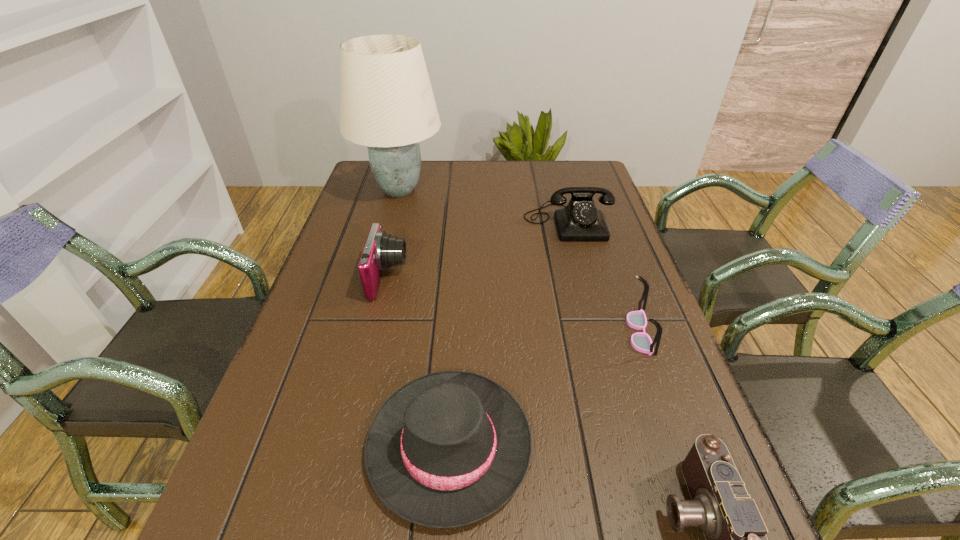
At what (x,y) coordinates should I click in order to perform the action: click on vacant region located on the right of the dress hat. Please return your answer as a coordinate pair (x, y). Looking at the image, I should click on (684, 445).

Locate an element on the screen. object that is at the far edge is located at coordinates (386, 100).

The width and height of the screenshot is (960, 540). What are the coordinates of `lampshade located in the left edge section of the desktop` in the screenshot? It's located at (386, 100).

You are a GUI agent. You are given a task and a screenshot of the screen. Output one action in this format:
    pyautogui.click(x=<x>, y=<y>)
    Task: Click on the camera positioned at the left edge
    
    Given the screenshot: What is the action you would take?
    pyautogui.click(x=381, y=250)

At what (x,y) coordinates should I click in order to perform the action: click on telephone at the right edge. Please return your answer as a coordinate pair (x, y). The width and height of the screenshot is (960, 540). Looking at the image, I should click on (580, 220).

Locate an element on the screen. This screenshot has height=540, width=960. spectacles that is at the right edge is located at coordinates (641, 341).

In order to click on object present at the far left corner in this screenshot , I will do `click(386, 100)`.

Locate an element on the screen. This screenshot has height=540, width=960. free space at the far edge is located at coordinates (431, 166).

In order to click on free space at the left edge of the desktop in this screenshot , I will do `click(389, 201)`.

This screenshot has height=540, width=960. Identify the location of vacant space at the right edge. (615, 354).